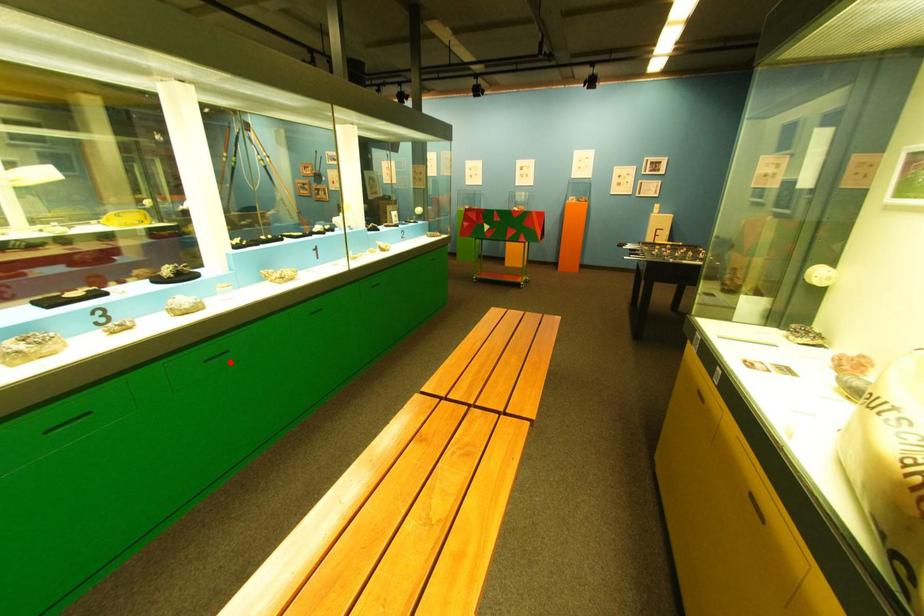
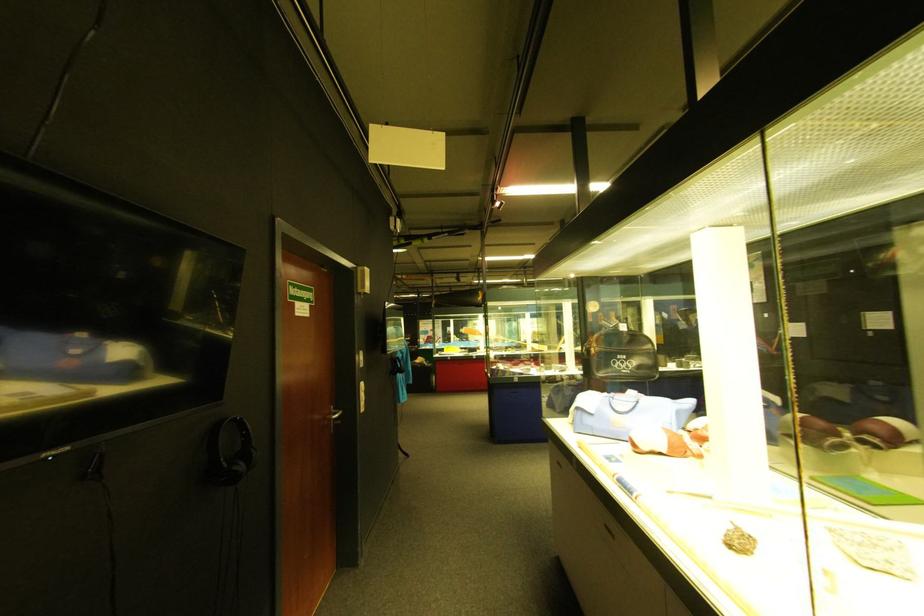
Question: I am providing you with two images of the same scene from different viewpoints. A red point is marked on the first image. Can you still see the location of the red point in image 2?

Choices:
 (A) Yes
 (B) No

Answer: (B)